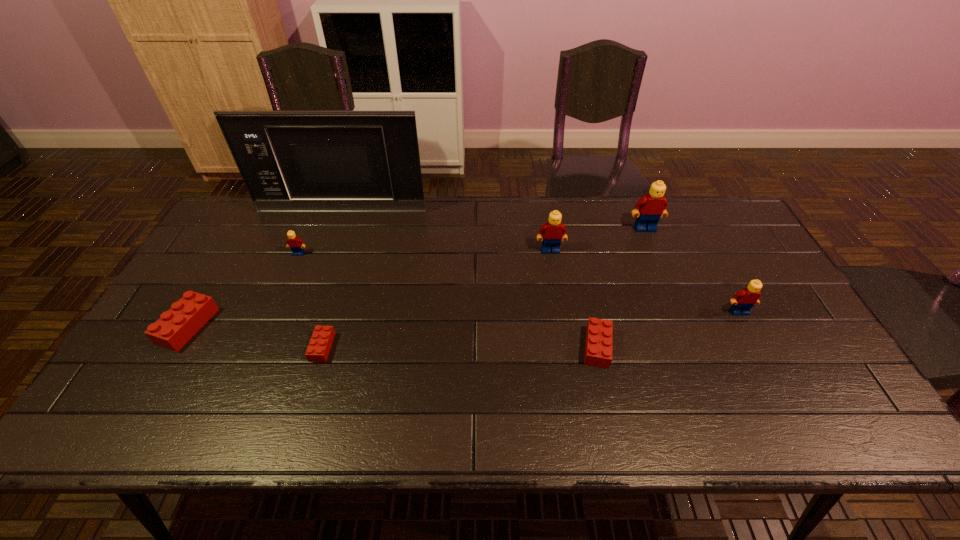
In the image, there is a desktop. Where is `free space at the far edge`? The image size is (960, 540). free space at the far edge is located at coordinates (289, 225).

Locate an element on the screen. The image size is (960, 540). blank space at the near edge of the desktop is located at coordinates (566, 417).

Identify the location of vacant area at the left edge of the desktop. (228, 293).

Where is `vacant region at the far right corner of the desktop`? Image resolution: width=960 pixels, height=540 pixels. vacant region at the far right corner of the desktop is located at coordinates (716, 198).

This screenshot has height=540, width=960. In the image, there is a desktop. In order to click on vacant space at the near right corner in this screenshot , I will do 848,422.

Identify the location of empty space between the third yellow Lego from left to right and the second red Lego from right to left. This screenshot has width=960, height=540. tap(484, 288).

Identify the location of free space between the smallest red Lego and the nearest yellow Lego. (531, 329).

Where is `free space between the second smallest red Lego and the microwave oven`? This screenshot has height=540, width=960. free space between the second smallest red Lego and the microwave oven is located at coordinates (469, 279).

In order to click on unoccupied area between the leftmost red Lego and the shortest Lego in this screenshot , I will do `click(255, 336)`.

Where is `vacant area that lies between the third Lego from left to right and the fourth shortest Lego`? vacant area that lies between the third Lego from left to right and the fourth shortest Lego is located at coordinates (310, 300).